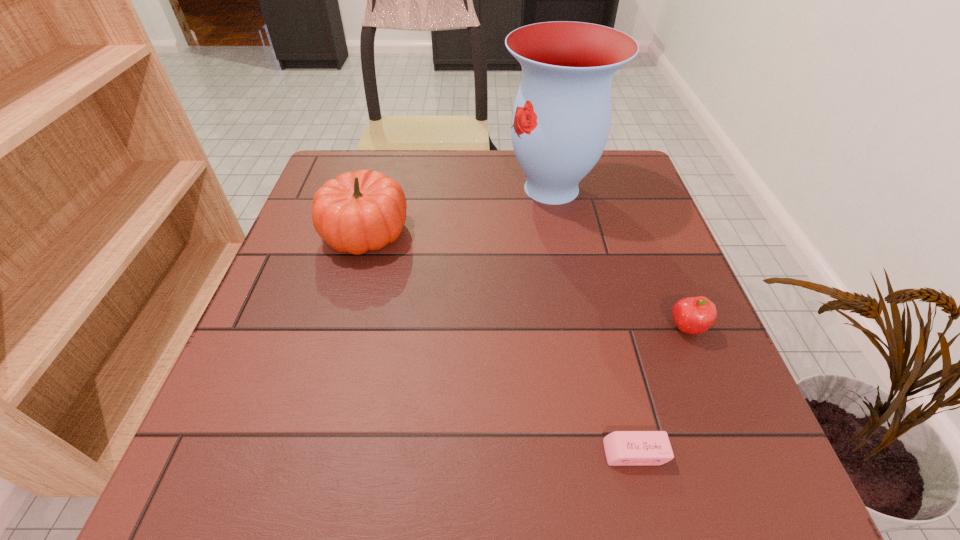
Where is `the tallest object`? The image size is (960, 540). the tallest object is located at coordinates (561, 119).

Find the location of a particular element. The height and width of the screenshot is (540, 960). pumpkin is located at coordinates (356, 212).

Identify the location of the third shortest object. This screenshot has height=540, width=960. (356, 212).

This screenshot has height=540, width=960. In order to click on the rightmost object in this screenshot , I will do pyautogui.click(x=692, y=315).

I want to click on the second shortest object, so click(x=692, y=315).

I want to click on eraser, so click(x=622, y=448).

Identify the location of the nearest object. (622, 448).

The image size is (960, 540). Find the location of `vacant area situated 0.380m on the left of the vase`. vacant area situated 0.380m on the left of the vase is located at coordinates (354, 188).

Locate an element on the screen. The width and height of the screenshot is (960, 540). free location located on the front of the pumpkin is located at coordinates (324, 377).

I want to click on free region located on the front of the rightmost object, so click(721, 413).